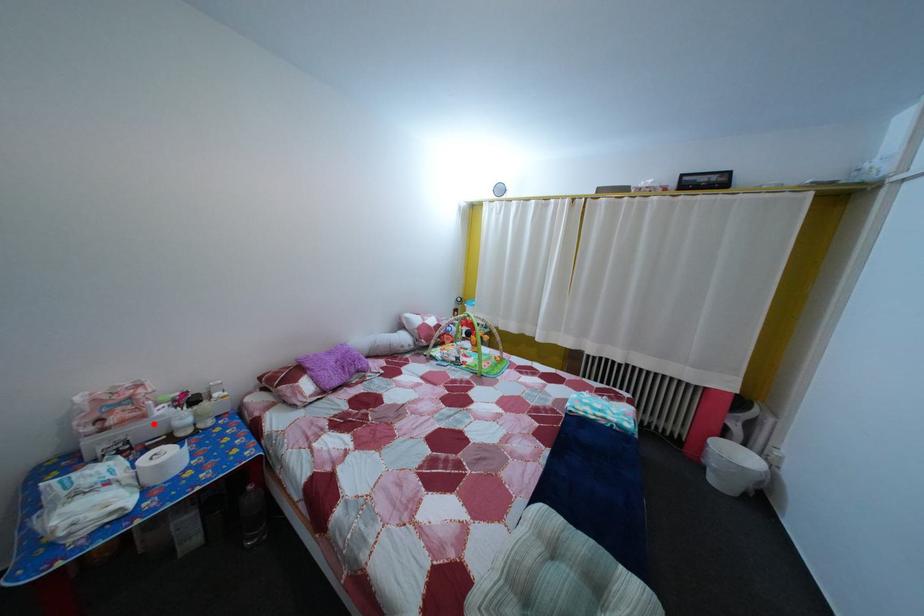
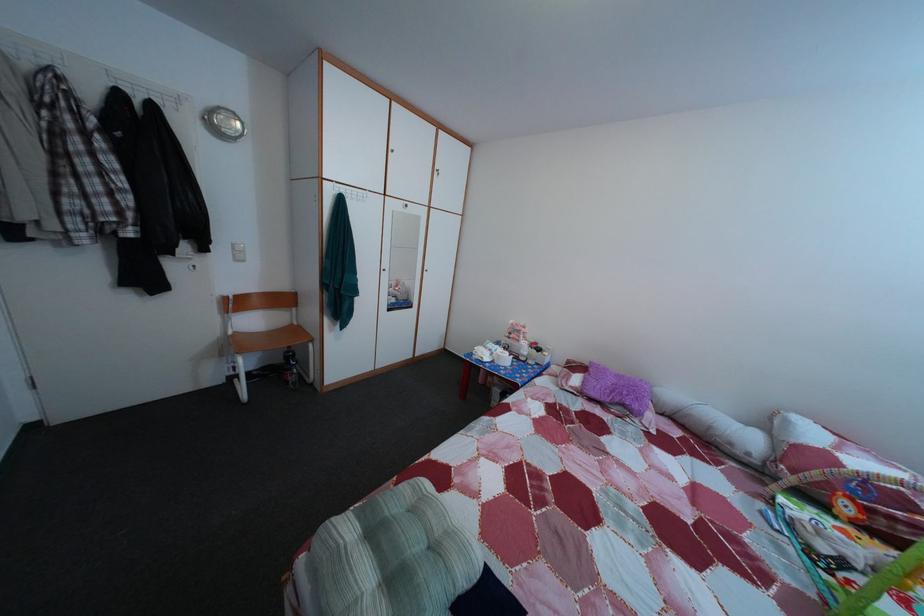
Where in the second image is the point corresponding to the highlighted location from the first image?

(528, 349)